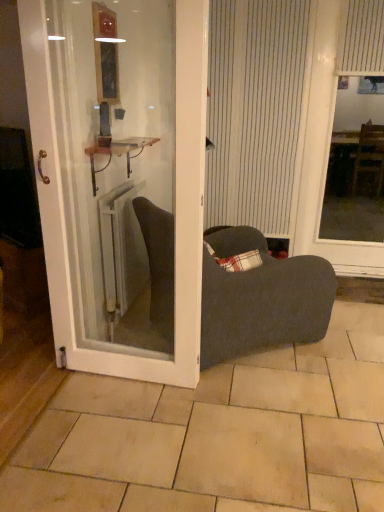
Where is `vacant space in front of dark gray fabric chair at center`? The image size is (384, 512). vacant space in front of dark gray fabric chair at center is located at coordinates (234, 424).